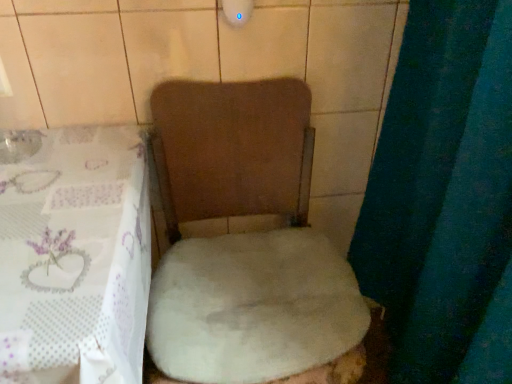
Question: Should I look upward or downward to see white fluffy rug at center?

Choices:
 (A) down
 (B) up

Answer: (A)

Question: From a real-world perspective, is white fluffy rug at center below white fluffy toilet at center?

Choices:
 (A) no
 (B) yes

Answer: (A)

Question: Is white fluffy rug at center completely or partially outside of white fluffy toilet at center?

Choices:
 (A) yes
 (B) no

Answer: (B)

Question: From the image's perspective, does white fluffy rug at center appear lower than white fluffy toilet at center?

Choices:
 (A) no
 (B) yes

Answer: (A)

Question: Can you confirm if white fluffy rug at center is smaller than white fluffy toilet at center?

Choices:
 (A) yes
 (B) no

Answer: (A)

Question: From a real-world perspective, is white fluffy rug at center physically above white fluffy toilet at center?

Choices:
 (A) no
 (B) yes

Answer: (B)

Question: Is white fluffy rug at center to the right of white fluffy toilet at center from the viewer's perspective?

Choices:
 (A) no
 (B) yes

Answer: (B)

Question: From a real-world perspective, is white fluffy toilet at center below white fluffy rug at center?

Choices:
 (A) yes
 (B) no

Answer: (A)

Question: Is white fluffy toilet at center taller than white fluffy rug at center?

Choices:
 (A) no
 (B) yes

Answer: (B)

Question: Are white fluffy toilet at center and white fluffy rug at center making contact?

Choices:
 (A) no
 (B) yes

Answer: (B)

Question: Considering the relative sizes of white fluffy toilet at center and white fluffy rug at center in the image provided, is white fluffy toilet at center wider than white fluffy rug at center?

Choices:
 (A) no
 (B) yes

Answer: (B)

Question: Is white fluffy toilet at center not close to white fluffy rug at center?

Choices:
 (A) no
 (B) yes

Answer: (A)

Question: Is white fluffy toilet at center facing towards white fluffy rug at center?

Choices:
 (A) yes
 (B) no

Answer: (A)

Question: Can you confirm if white fluffy toilet at center is shorter than white sheer tablecloth at lower left?

Choices:
 (A) no
 (B) yes

Answer: (A)